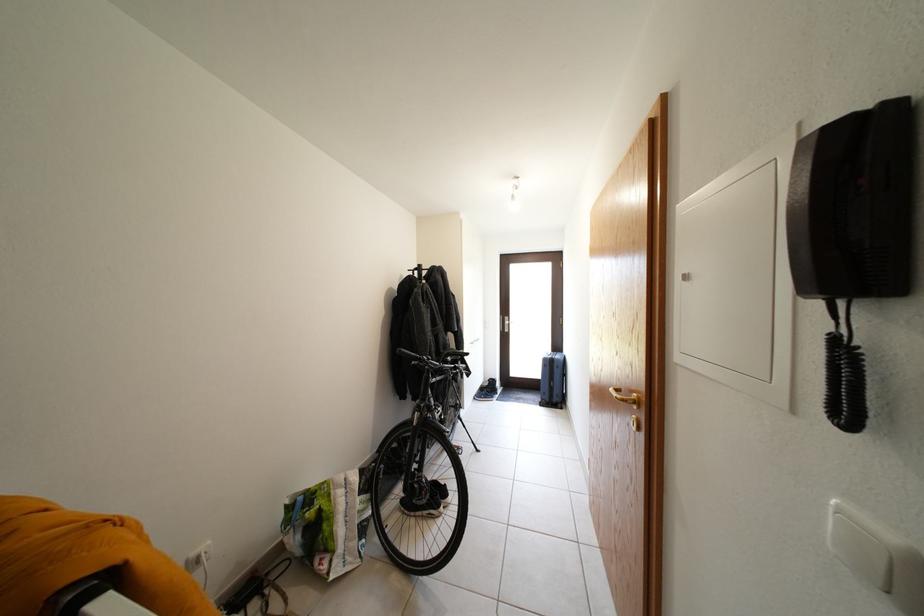
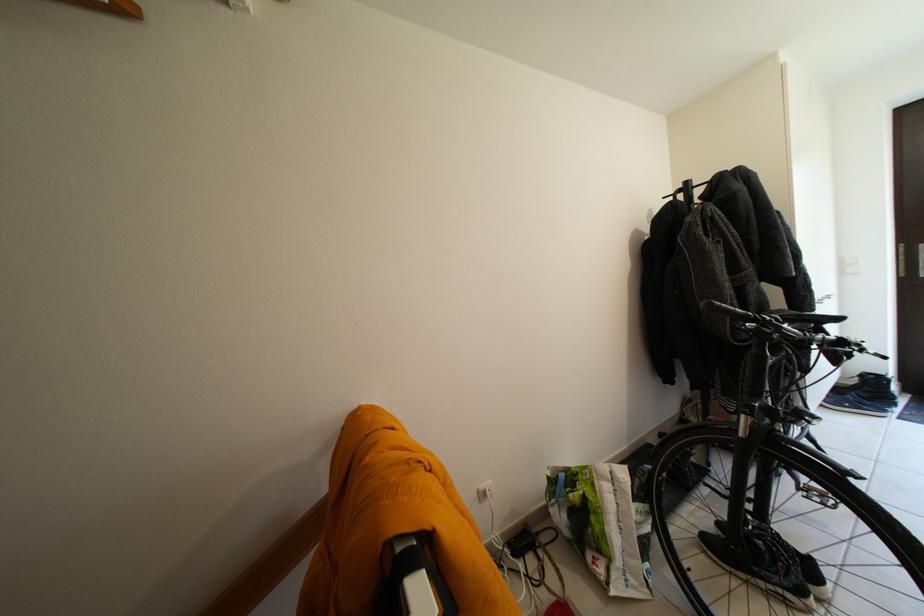
Locate, in the second image, the point that corresponds to [367,513] in the first image.

(642, 522)